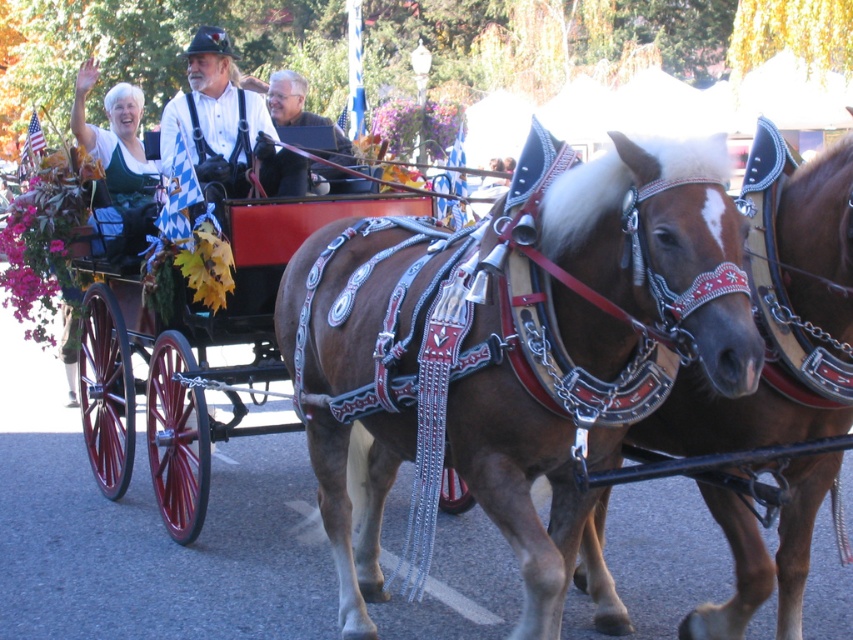
From the picture: How far apart are brown shiny horse at center and white fabric at upper left?

brown shiny horse at center and white fabric at upper left are 17.32 feet apart.

Does brown shiny horse at center come behind white fabric at upper left?

No, brown shiny horse at center is in front of white fabric at upper left.

Does point (830, 172) come closer to viewer compared to point (115, 188)?

That is True.

Identify the location of brown shiny horse at center. (780, 312).

Does point (320, 285) come farther from viewer compared to point (289, 112)?

No, it is in front of (289, 112).

Is point (372, 472) behind point (274, 81)?

No, it is in front of (274, 81).

At what (x,y) coordinates should I click in order to perform the action: click on brown glossy horse at center. Please return your answer as a coordinate pair (x, y). Looking at the image, I should click on (503, 346).

Who is shorter, matte leather jacket at center or matte brown leather jacket at center?

Standing shorter between the two is matte brown leather jacket at center.

Can you confirm if matte leather jacket at center is positioned to the right of matte brown leather jacket at center?

In fact, matte leather jacket at center is to the left of matte brown leather jacket at center.

What do you see at coordinates (218, 116) in the screenshot? I see `matte leather jacket at center` at bounding box center [218, 116].

Locate an element on the screen. matte leather jacket at center is located at coordinates (218, 116).